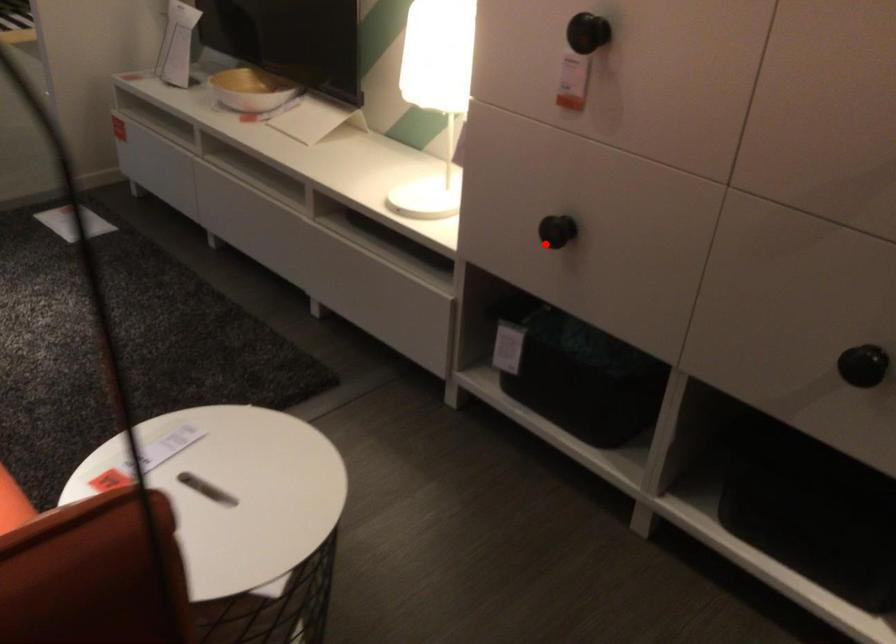
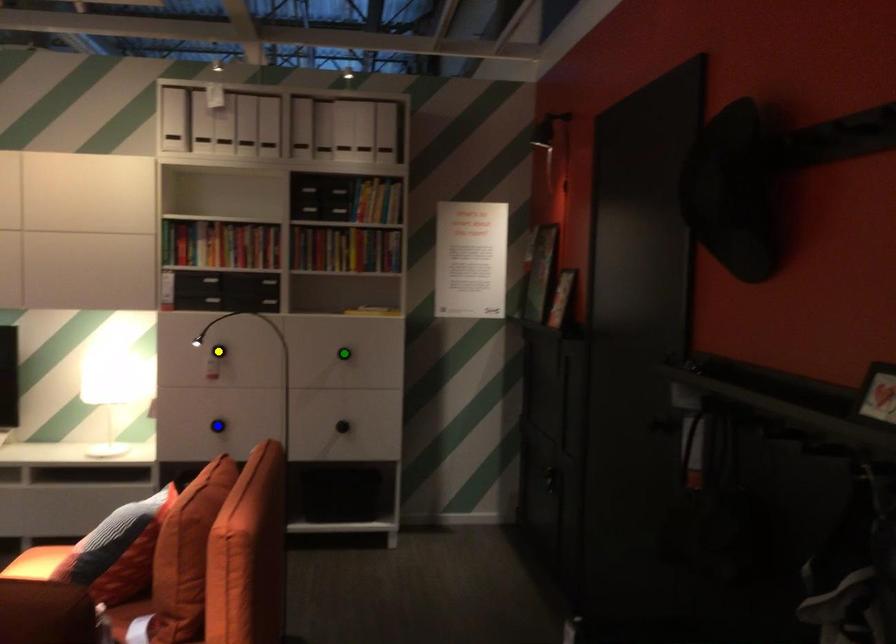
Question: I am providing you with two images of the same scene from different viewpoints. A red point is marked on the first image. You are given multiple points on the second image. Which spot in image 2 lines up with the point in image 1?

Choices:
 (A) yellow point
 (B) blue point
 (C) green point

Answer: (B)